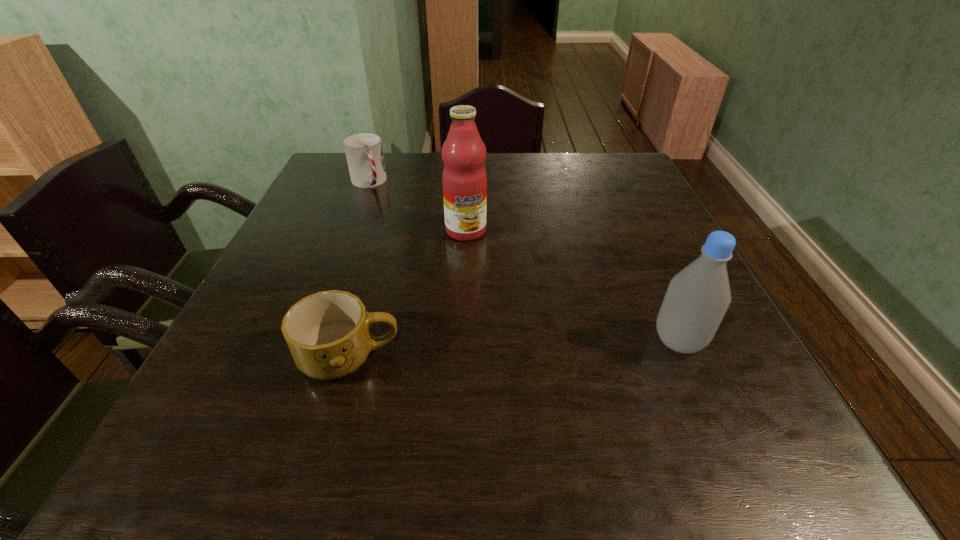
You are a GUI agent. You are given a task and a screenshot of the screen. Output one action in this format:
    pyautogui.click(x=<x>, y=<y>)
    Task: Click on the vacant space located on the side of the farthest object where the handle is located
    
    Given the screenshot: What is the action you would take?
    pyautogui.click(x=419, y=270)

You are a GUI agent. You are given a task and a screenshot of the screen. Output one action in this format:
    pyautogui.click(x=<x>, y=<y>)
    Task: Click on the free region located 0.250m on the label of the second object from right to left
    The width and height of the screenshot is (960, 540).
    Given the screenshot: What is the action you would take?
    pyautogui.click(x=488, y=318)

Identify the location of vacant region located on the label of the second object from right to left. The height and width of the screenshot is (540, 960). (473, 261).

Identify the location of vacant region located on the label of the second object from right to left. (483, 296).

This screenshot has height=540, width=960. What are the coordinates of `object that is at the far edge` in the screenshot? It's located at (364, 153).

I want to click on object at the near edge, so pos(328,333).

I want to click on mug that is at the left edge, so click(x=328, y=333).

At what (x,y) coordinates should I click in order to perform the action: click on cup that is at the left edge. Please return your answer as a coordinate pair (x, y). This screenshot has width=960, height=540. Looking at the image, I should click on (364, 153).

Image resolution: width=960 pixels, height=540 pixels. I want to click on object located in the right edge section of the desktop, so click(697, 298).

Where is `object present at the far left corner`? This screenshot has height=540, width=960. object present at the far left corner is located at coordinates [364, 153].